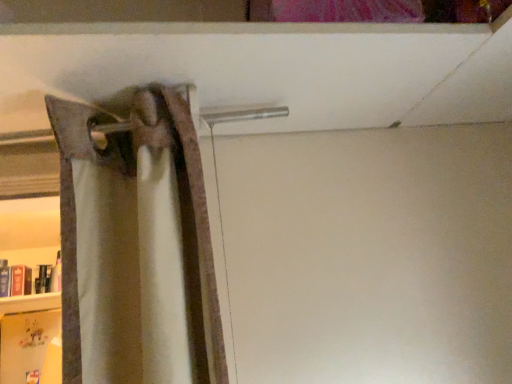
The height and width of the screenshot is (384, 512). Describe the element at coordinates (5, 278) in the screenshot. I see `hardcover book at left` at that location.

This screenshot has width=512, height=384. What are the coordinates of `hardcover book at left` in the screenshot? It's located at (5, 278).

You are a GUI agent. You are given a task and a screenshot of the screen. Output one action in this format:
    pyautogui.click(x=<x>, y=<y>)
    Task: Click on the hardcover book at left
    Image resolution: width=512 pixels, height=384 pixels.
    Given the screenshot: What is the action you would take?
    pyautogui.click(x=5, y=278)